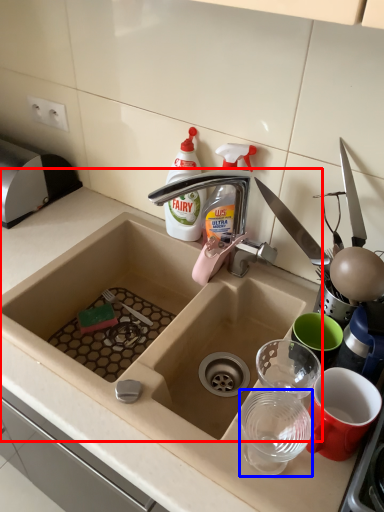
Question: Which object appears closest to the camera in this image, sink (highlighted by a red box) or tableware (highlighted by a blue box)?

Choices:
 (A) sink
 (B) tableware

Answer: (A)